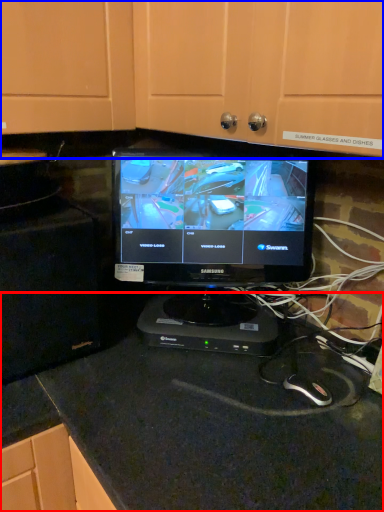
Question: Which of the following is the farthest to the observer, counter top (highlighted by a red box) or dresser (highlighted by a blue box)?

Choices:
 (A) counter top
 (B) dresser

Answer: (A)